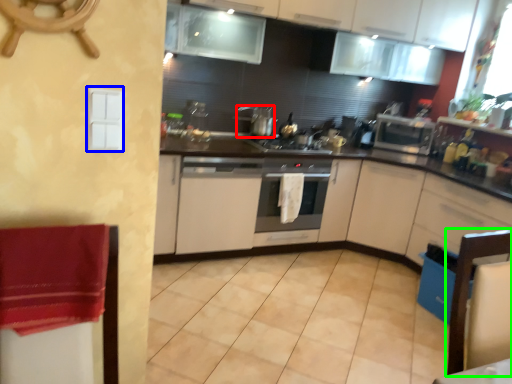
Question: Based on their relative distances, which object is nearer to kitchen appliance (highlighted by a red box)? Choose from light switch (highlighted by a blue box) and chair (highlighted by a green box).

Choices:
 (A) light switch
 (B) chair

Answer: (B)